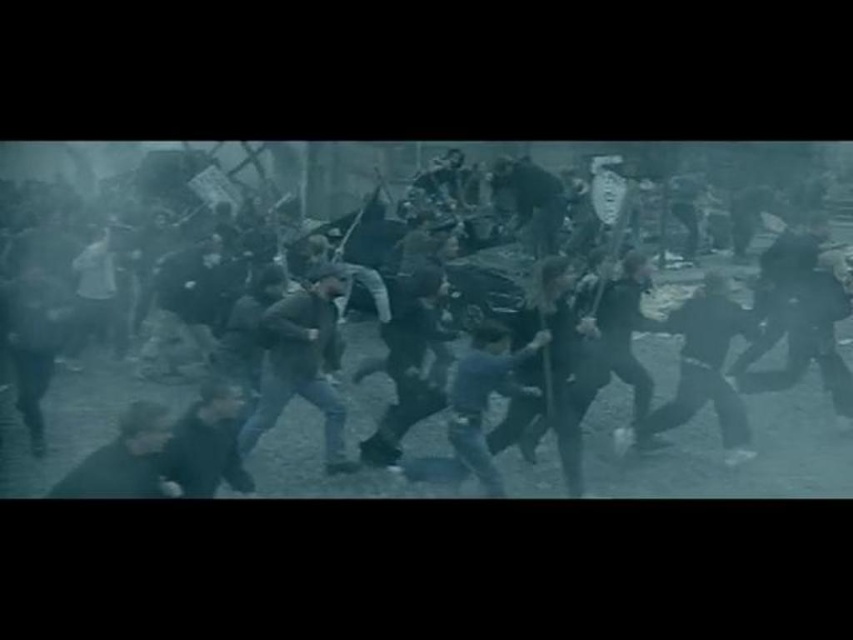
You are a photographer trying to capture a clear shot of the dark blue jeans at center and the dark gray fabric at lower left. Your camera has a maximum focus range of 6 feet. Can you focus on both objects simultaneously?

The dark blue jeans at center is 6.46 feet away from the dark gray fabric at lower left. Since the distance between them exceeds the camera maximum focus range of 6 feet, you cannot focus on both objects simultaneously.

You are a photographer trying to capture the chaotic scene of the protest. You notice two points in the image at coordinates point (149, 312) and point (514, 204). Which point will appear larger in your photo?

Point (149, 312) is closer to the camera than point (514, 204), so it will appear larger in the photo.

You are a photographer trying to capture a clear shot of the dark gray fabric jacket at lower left and the dark gray fabric coat at center in this tense scene. Since the two are in the same frame, which one would appear wider in your photo?

The dark gray fabric jacket at lower left has a lesser width compared to dark gray fabric coat at center, so the dark gray fabric coat at center would appear wider in the photo.